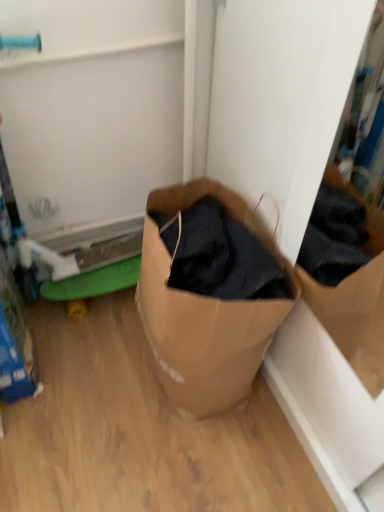
At what (x,y) coordinates should I click in order to perform the action: click on vacant region to the left of brown paper bag at center. Please return your answer as a coordinate pair (x, y). Image resolution: width=384 pixels, height=512 pixels. Looking at the image, I should click on (89, 377).